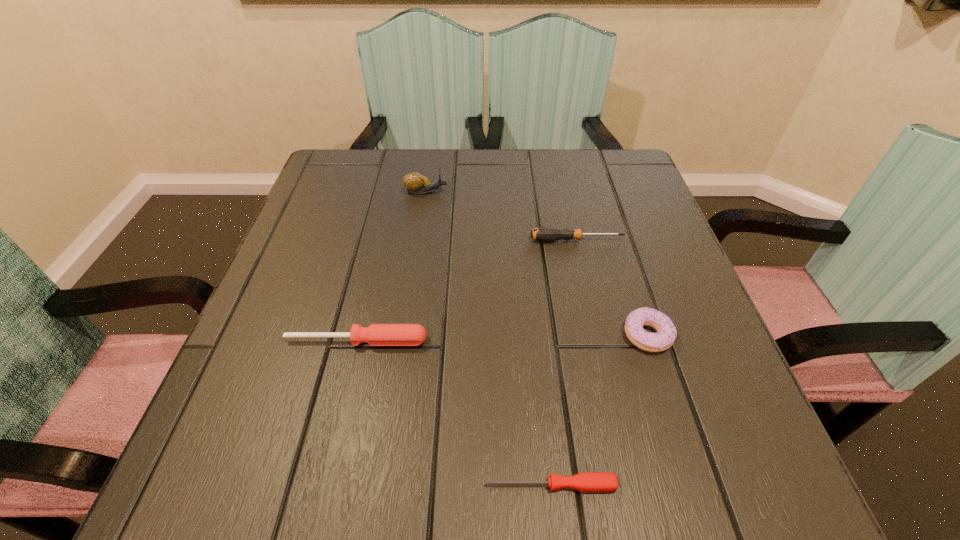
Image resolution: width=960 pixels, height=540 pixels. Identify the location of vacant space at the left edge of the desktop. (360, 232).

The width and height of the screenshot is (960, 540). In order to click on vacant point at the right edge in this screenshot , I will do `click(619, 331)`.

Image resolution: width=960 pixels, height=540 pixels. I want to click on free space at the far left corner, so click(x=385, y=170).

The width and height of the screenshot is (960, 540). In order to click on vacant position at the near left corner of the desktop in this screenshot , I will do `click(175, 503)`.

Locate an element on the screen. Image resolution: width=960 pixels, height=540 pixels. vacant space at the far right corner is located at coordinates (646, 183).

Where is `blank space at the near right corner of the desktop`? The image size is (960, 540). blank space at the near right corner of the desktop is located at coordinates (730, 462).

Where is `vacant space that is in between the second nearest screwdriver and the nearest object`? vacant space that is in between the second nearest screwdriver and the nearest object is located at coordinates (454, 413).

This screenshot has width=960, height=540. I want to click on empty space that is in between the farthest screwdriver and the shortest object, so click(564, 362).

Image resolution: width=960 pixels, height=540 pixels. I want to click on unoccupied position between the escargot and the leftmost screwdriver, so click(392, 266).

The image size is (960, 540). I want to click on vacant region between the shortest object and the doughnut, so click(599, 410).